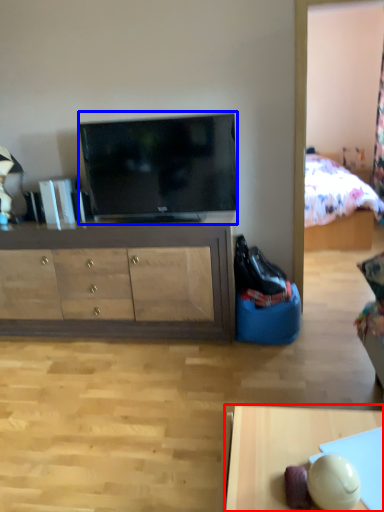
Question: Which object is closer to the camera taking this photo, desk (highlighted by a red box) or television (highlighted by a blue box)?

Choices:
 (A) desk
 (B) television

Answer: (A)